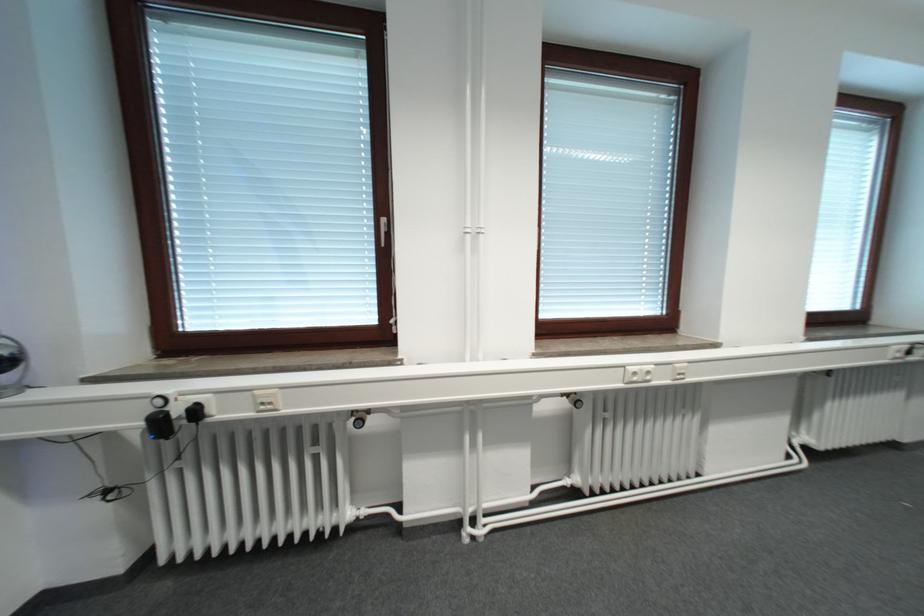
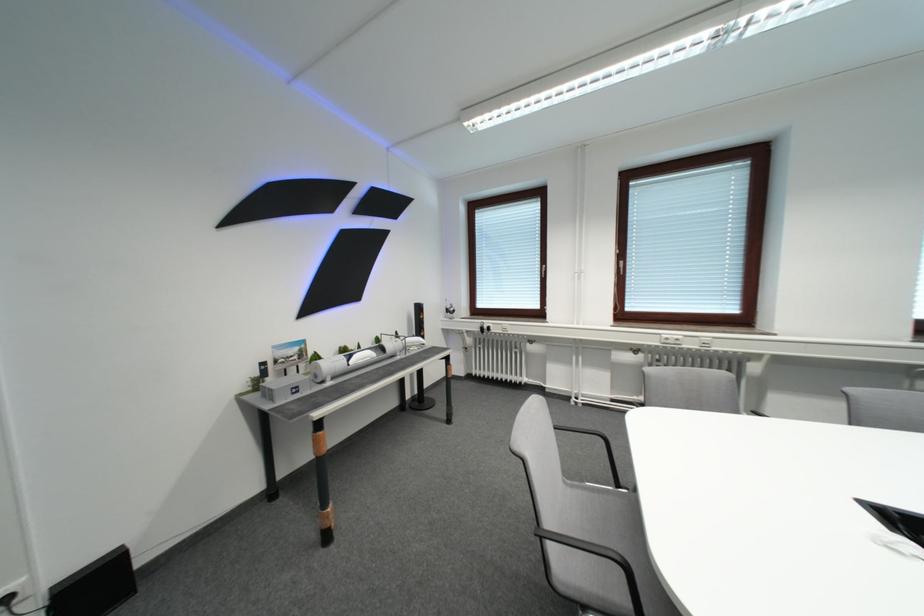
In the second image, find the point that corresponds to the point at 394,223 in the first image.

(553, 269)